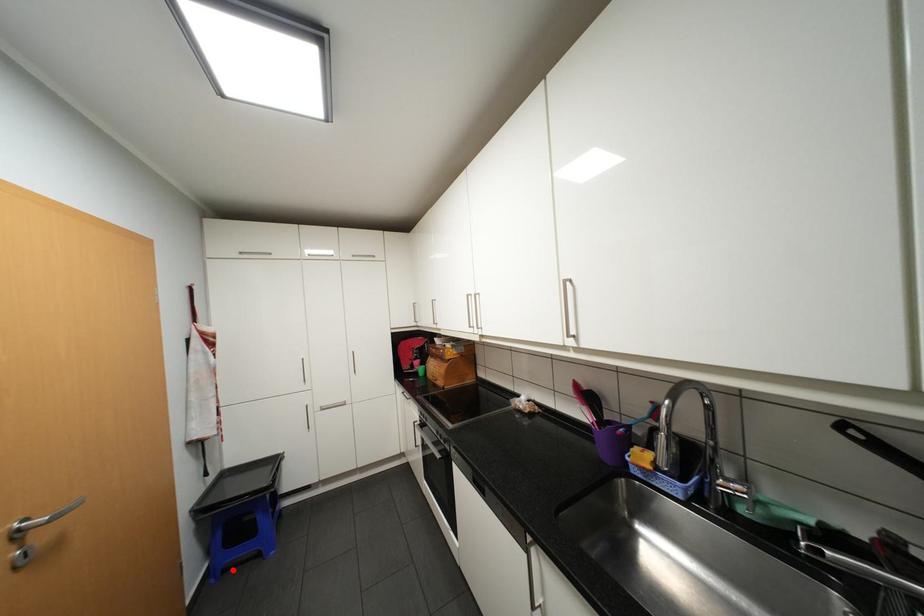
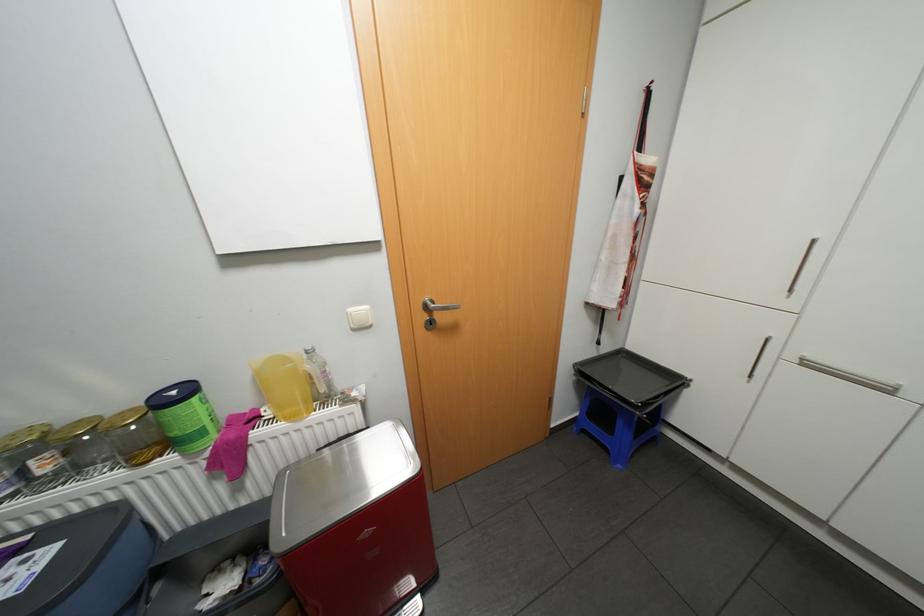
Question: I am providing you with two images of the same scene from different viewpoints. In image1, a red point is highlighted. Considering the same 3D point in image2, which of the following is correct?

Choices:
 (A) It is closer
 (B) It is farther

Answer: (B)